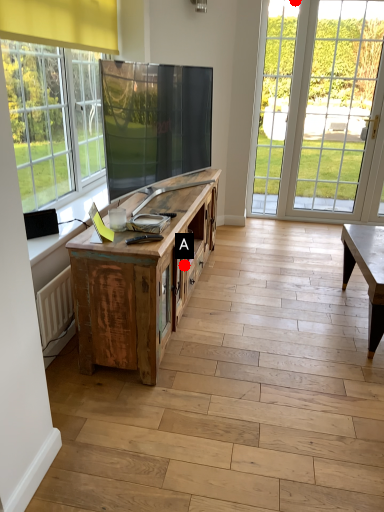
Question: Two points are circled on the image, labeled by A and B beside each circle. Which of the following is the farthest from the observer?

Choices:
 (A) A is further
 (B) B is further

Answer: (B)